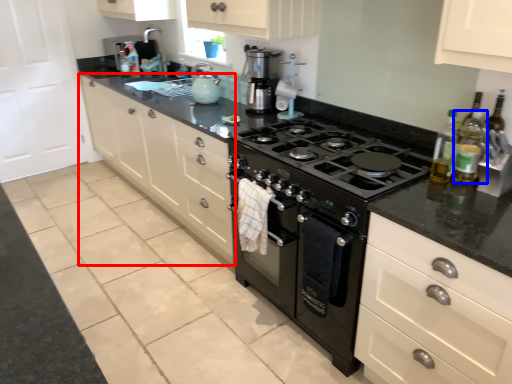
Question: Which point is further to the camera, cabinetry (highlighted by a red box) or bottle (highlighted by a blue box)?

Choices:
 (A) cabinetry
 (B) bottle

Answer: (A)